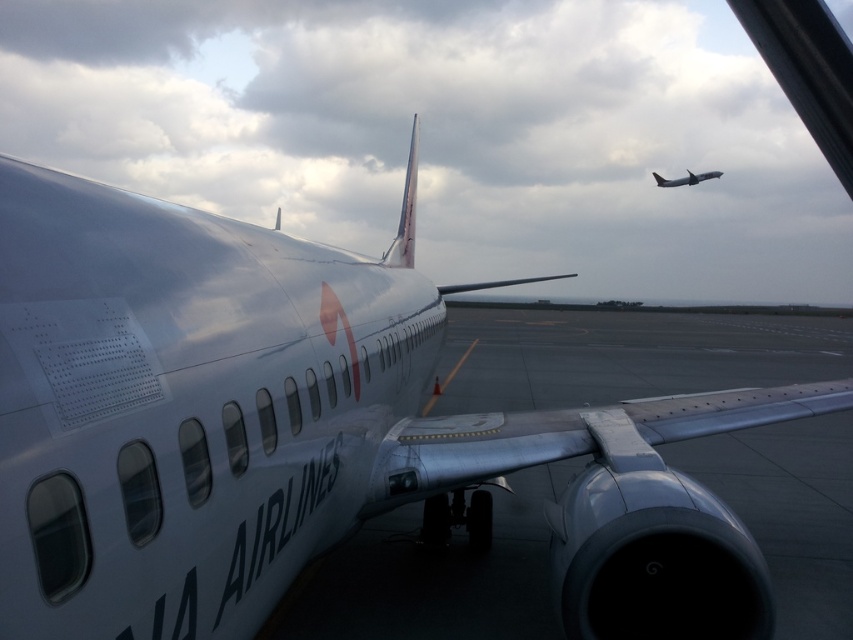
Question: Which point is farther from the camera taking this photo?

Choices:
 (A) (399, 426)
 (B) (689, 179)

Answer: (B)

Question: Is metallic silver wing at center to the right of silver metallic airplane at upper right from the viewer's perspective?

Choices:
 (A) no
 (B) yes

Answer: (A)

Question: Can you confirm if metallic silver wing at center is positioned to the right of silver metallic airplane at upper right?

Choices:
 (A) no
 (B) yes

Answer: (A)

Question: Which object appears closest to the camera in this image?

Choices:
 (A) metallic silver wing at center
 (B) silver metallic airplane at upper right

Answer: (A)

Question: Does metallic silver wing at center have a smaller size compared to silver metallic airplane at upper right?

Choices:
 (A) yes
 (B) no

Answer: (A)